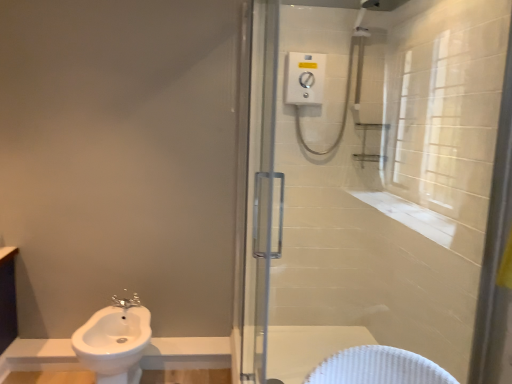
This screenshot has height=384, width=512. Identify the location of white glossy sink at lower left. (114, 341).

In order to click on satin nickel faucet at lower left in this screenshot , I will do `click(126, 302)`.

Does white glossy sink at lower left appear on the left side of clear glass shower door at center?

Yes, white glossy sink at lower left is to the left of clear glass shower door at center.

Is white glossy sink at lower left facing away from clear glass shower door at center?

white glossy sink at lower left is not turned away from clear glass shower door at center.

Considering the sizes of objects white glossy sink at lower left and clear glass shower door at center in the image provided, who is wider, white glossy sink at lower left or clear glass shower door at center?

With larger width is white glossy sink at lower left.

Considering the relative sizes of white glossy sink at lower left and clear glass shower door at center in the image provided, is white glossy sink at lower left shorter than clear glass shower door at center?

Yes, white glossy sink at lower left is shorter than clear glass shower door at center.

How many degrees apart are the facing directions of satin nickel faucet at lower left and clear glass shower door at center?

The angle between the facing direction of satin nickel faucet at lower left and the facing direction of clear glass shower door at center is 91.2 degrees.

Measure the distance from satin nickel faucet at lower left to clear glass shower door at center.

They are 3.45 feet apart.

Is satin nickel faucet at lower left to the right of clear glass shower door at center from the viewer's perspective?

Incorrect, satin nickel faucet at lower left is not on the right side of clear glass shower door at center.

Locate an element on the screen. The height and width of the screenshot is (384, 512). screen door that appears above the satin nickel faucet at lower left (from a real-world perspective) is located at coordinates (261, 190).

Is clear glass shower door at center not near white glossy sink at lower left?

No, clear glass shower door at center is in close proximity to white glossy sink at lower left.

Could you tell me if clear glass shower door at center is facing white glossy sink at lower left?

No, clear glass shower door at center is not aimed at white glossy sink at lower left.

Is clear glass shower door at center smaller than white glossy sink at lower left?

Yes.

From the image's perspective, which one is positioned higher, clear glass shower door at center or white glossy sink at lower left?

clear glass shower door at center.

Is clear glass shower door at center placed right next to satin nickel faucet at lower left?

No.

Does clear glass shower door at center have a lesser height compared to satin nickel faucet at lower left?

No, clear glass shower door at center is not shorter than satin nickel faucet at lower left.

From the picture: From the image's perspective, is clear glass shower door at center positioned above or below satin nickel faucet at lower left?

Based on their image positions, clear glass shower door at center is located above satin nickel faucet at lower left.

This screenshot has width=512, height=384. I want to click on screen door positioned vertically above the satin nickel faucet at lower left (from a real-world perspective), so point(261,190).

Is white glossy sink at lower left closer to camera compared to satin nickel faucet at lower left?

Yes, it is in front of satin nickel faucet at lower left.

From the picture: Is white glossy sink at lower left bigger than satin nickel faucet at lower left?

Yes.

Can you confirm if white glossy sink at lower left is wider than satin nickel faucet at lower left?

Yes, white glossy sink at lower left is wider than satin nickel faucet at lower left.

From a real-world perspective, is white glossy sink at lower left physically below satin nickel faucet at lower left?

Indeed, from a real-world perspective, white glossy sink at lower left is positioned beneath satin nickel faucet at lower left.

Does satin nickel faucet at lower left have a greater width compared to white glossy sink at lower left?

No.

Between satin nickel faucet at lower left and white glossy sink at lower left, which one appears on the left side from the viewer's perspective?

white glossy sink at lower left.

Consider the image. Is satin nickel faucet at lower left not inside white glossy sink at lower left?

satin nickel faucet at lower left lies outside white glossy sink at lower left's area.

This screenshot has width=512, height=384. I want to click on screen door that is in front of the white glossy sink at lower left, so click(261, 190).

Where is `tap on the left of clear glass shower door at center`? tap on the left of clear glass shower door at center is located at coordinates (126, 302).

From the image, which object appears to be farther from white glossy sink at lower left, satin nickel faucet at lower left or clear glass shower door at center?

The object further to white glossy sink at lower left is clear glass shower door at center.

Considering their positions, is white glossy sink at lower left positioned closer to satin nickel faucet at lower left than clear glass shower door at center?

Among the two, white glossy sink at lower left is located nearer to satin nickel faucet at lower left.

Looking at the image, which one is located closer to clear glass shower door at center, white glossy sink at lower left or satin nickel faucet at lower left?

white glossy sink at lower left is closer to clear glass shower door at center.

Considering their positions, is satin nickel faucet at lower left positioned closer to clear glass shower door at center than white glossy sink at lower left?

Based on the image, white glossy sink at lower left appears to be nearer to clear glass shower door at center.

Estimate the real-world distances between objects in this image. Which object is closer to satin nickel faucet at lower left, clear glass shower door at center or white glossy sink at lower left?

white glossy sink at lower left.

Which object lies further to the anchor point white glossy sink at lower left, clear glass shower door at center or satin nickel faucet at lower left?

Among the two, clear glass shower door at center is located further to white glossy sink at lower left.

This screenshot has height=384, width=512. In order to click on sink located between clear glass shower door at center and satin nickel faucet at lower left in the depth direction in this screenshot , I will do `click(114, 341)`.